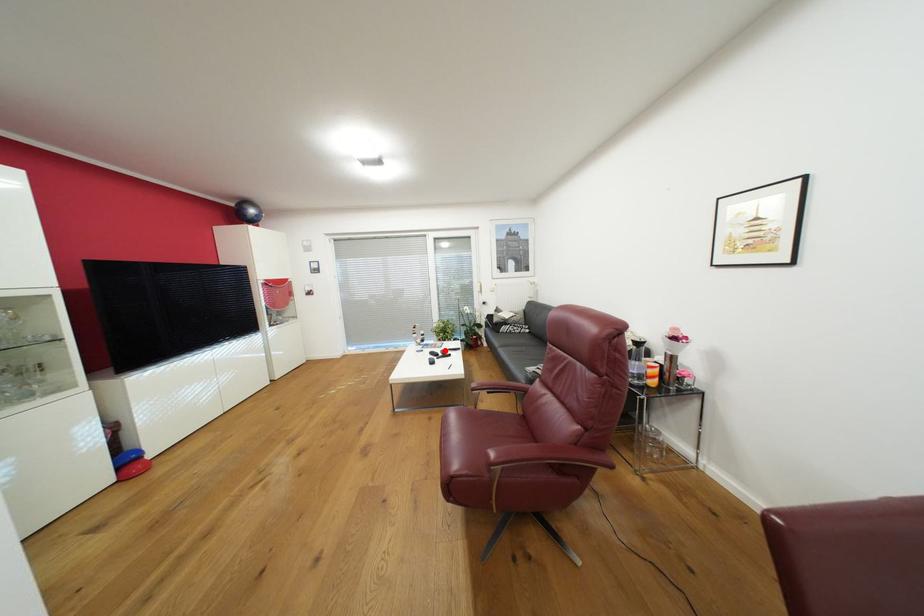
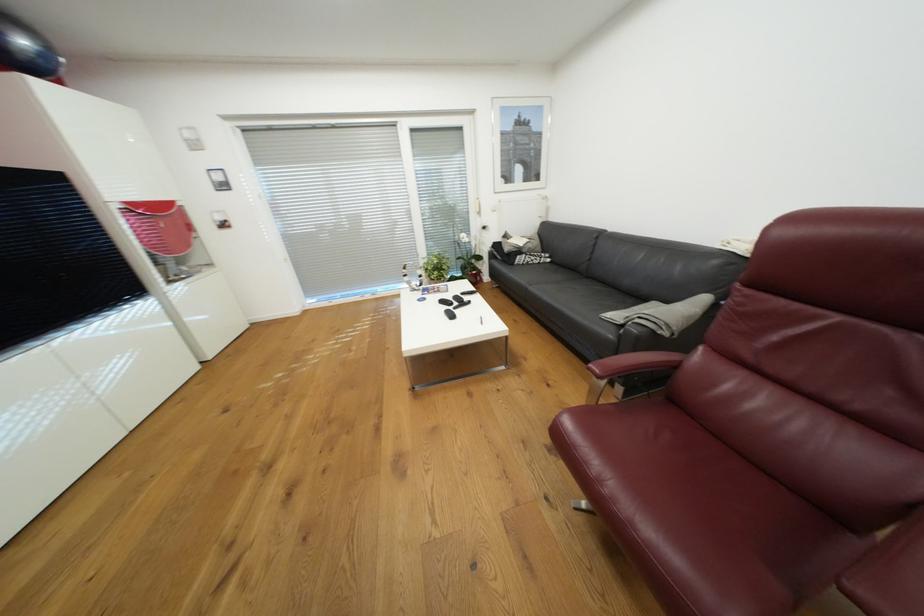
The point at the highlighted location is marked in the first image. Where is the corresponding point in the second image?

(456, 297)